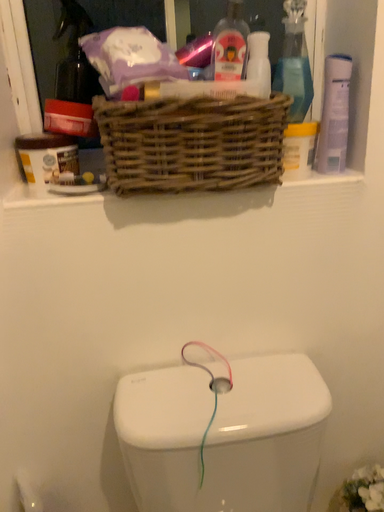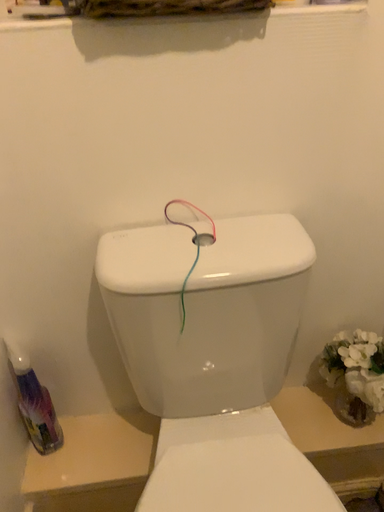
Question: How did the camera likely rotate when shooting the video?

Choices:
 (A) rotated upward
 (B) rotated downward

Answer: (B)